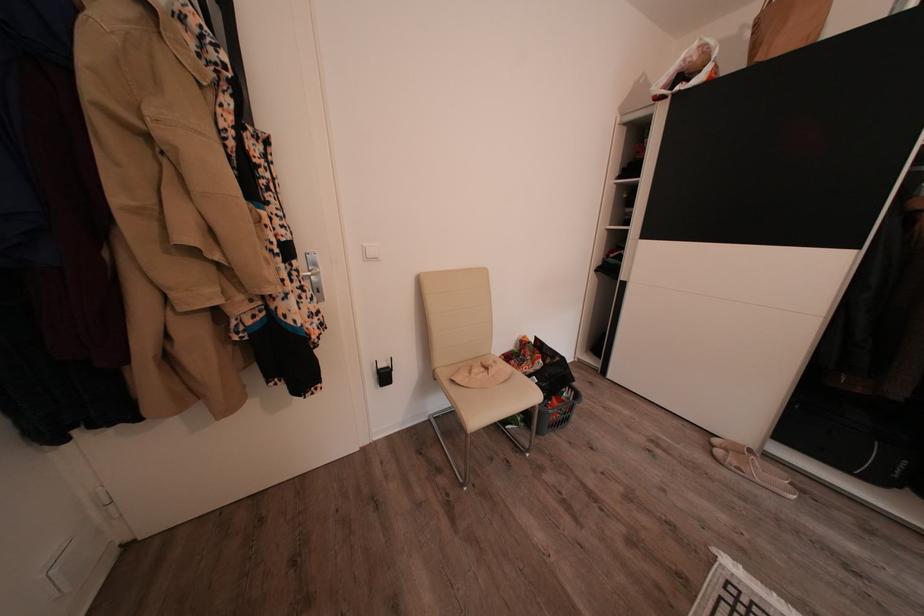
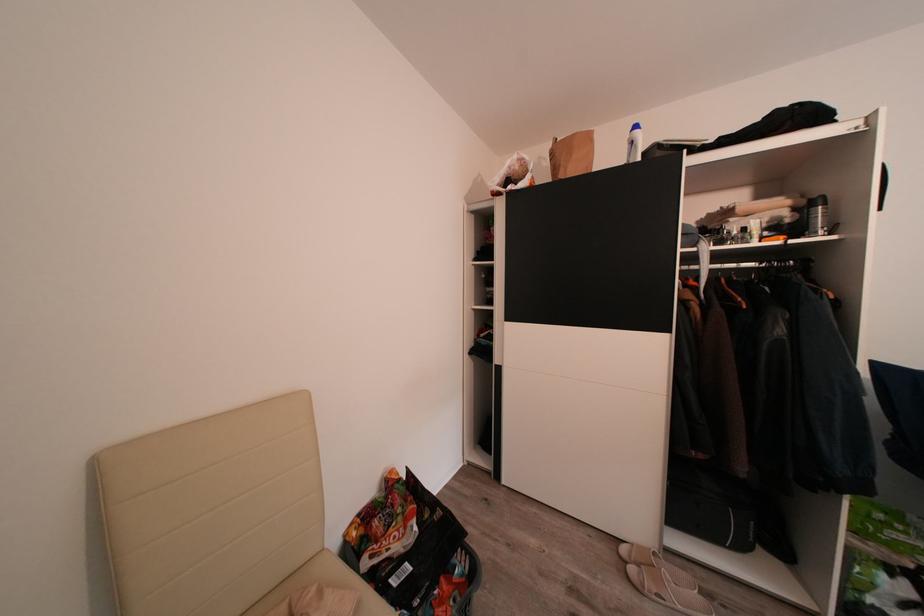
Where in the second image is the point corresponding to the point at 560,405 from the first image?

(446, 589)